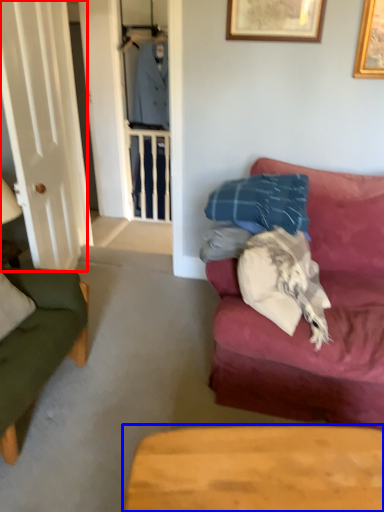
Question: Which point is further to the camera, glass door (highlighted by a red box) or table (highlighted by a blue box)?

Choices:
 (A) glass door
 (B) table

Answer: (A)